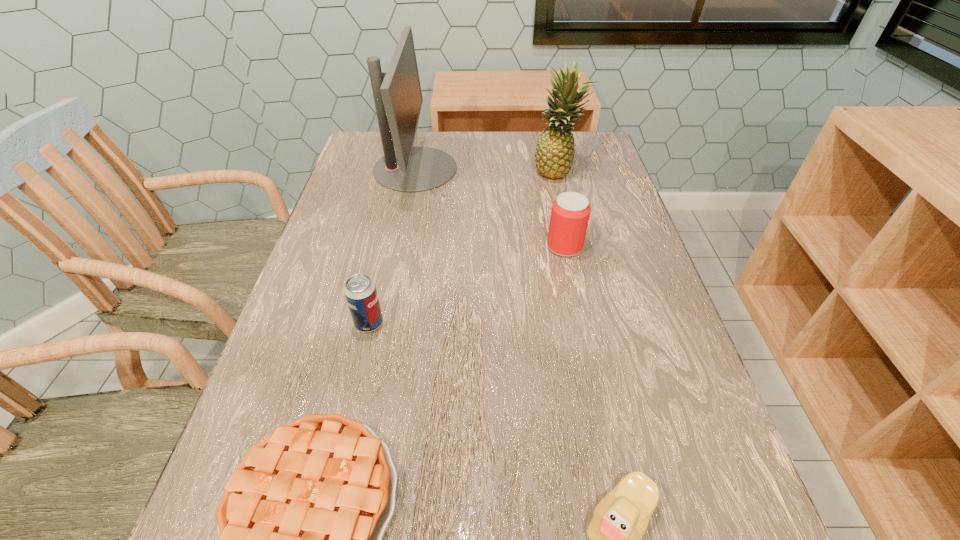
Locate an element on the screen. The width and height of the screenshot is (960, 540). free region at the right edge is located at coordinates (610, 217).

Where is `vacant position at the far left corner of the desktop`? The width and height of the screenshot is (960, 540). vacant position at the far left corner of the desktop is located at coordinates (362, 146).

Where is `free space between the nearer beer can and the right beer can`? The width and height of the screenshot is (960, 540). free space between the nearer beer can and the right beer can is located at coordinates (467, 285).

You are a GUI agent. You are given a task and a screenshot of the screen. Output one action in this format:
    pyautogui.click(x=<x>, y=<y>)
    Task: Click on the vacant space in between the farther beer can and the third nearest object
    
    Given the screenshot: What is the action you would take?
    pyautogui.click(x=467, y=285)

Identify the location of vacant area that lies between the left beer can and the farther beer can. The height and width of the screenshot is (540, 960). (467, 285).

Identify the location of object that stands as the closest to the second shortest object. (300, 525).

The image size is (960, 540). I want to click on the fourth closest object to the shortest object, so click(398, 99).

Identify the location of free spot that satisfies the following two spatial constraints: 1. on the back side of the pineapple; 2. on the screen of the computer monitor. (556, 168).

The image size is (960, 540). Identify the location of free space that satisfies the following two spatial constraints: 1. on the back side of the pineapple; 2. on the left side of the third farthest object. (549, 171).

This screenshot has width=960, height=540. I want to click on free location that satisfies the following two spatial constraints: 1. on the screen of the pineapple; 2. on the left side of the computer monitor, so click(415, 171).